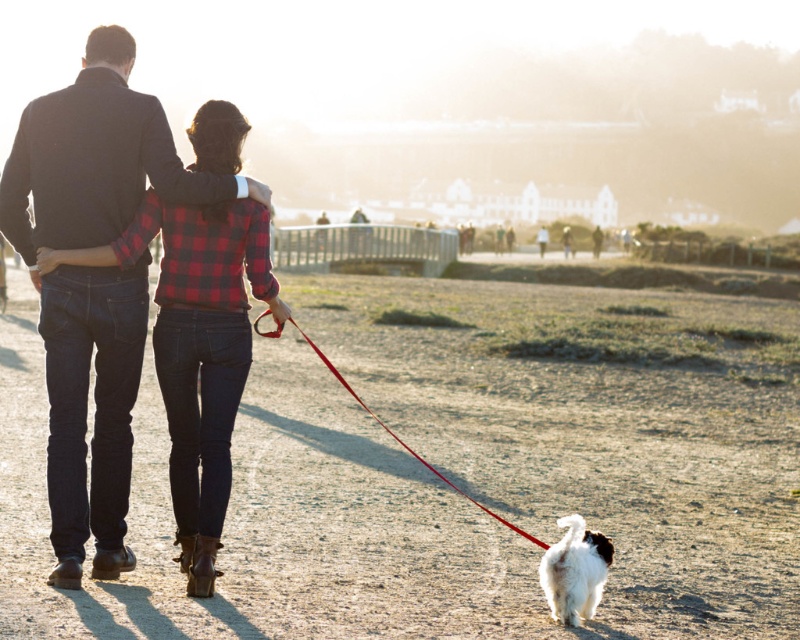
You are standing at the camera position observing the scene. The fluffy white dog at lower center is at coordinates approximately 0.894 on the x axis and 0.719 on the y axis. If you want to throw a ball to the dog, which direction should you move in relation to your current position?

The fluffy white dog at lower center is located at point (574,572). To throw the ball to the dog, you should move towards the lower center direction from your current position at the camera.

You are a photographer trying to capture the fluffy white dog at lower center and the red nylon leash at lower center in a single frame. Which object should you focus on if you want to ensure the thinner one is in sharp focus?

The fluffy white dog at lower center is thinner than the red nylon leash at lower center, so you should focus on the fluffy white dog at lower center to ensure the thinner one is in sharp focus.